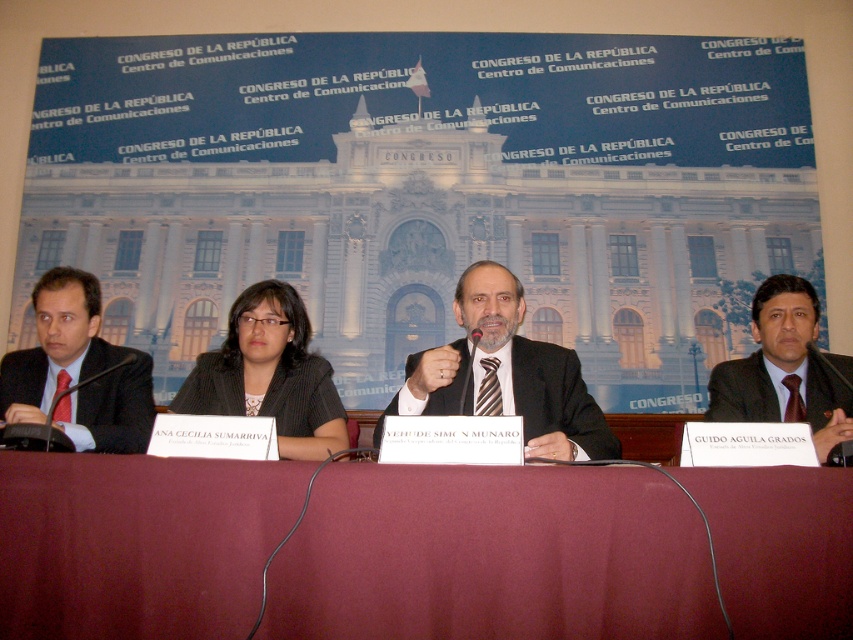
You are organizing a photoshoot for a fashion magazine and need to arrange two suits for a layout. The black textured suit at center and the matte black suit at left are available. Based on their sizes, which one should be placed first in the layout to emphasize size contrast?

The black textured suit at center is larger in size than the matte black suit at left, so placing it first in the layout will effectively emphasize the size contrast between the two suits.

You are attending the press conference and want to move from the point at coordinate (677, 538) to the point at coordinate (517, 374). Which direction should you move?

You should move backward because point (677, 538) is in front of point (517, 374).

From the picture: You are attending the press conference and need to identify the person wearing the black textured suit at center. Based on their position relative to the table, where would you find them?

The black textured suit at center is located at point (270, 374), which would place them in the middle section of the table.